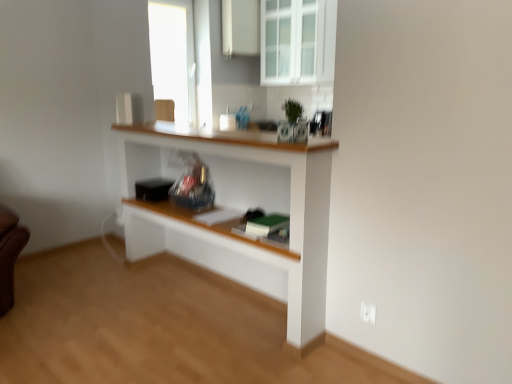
From the picture: Measure the distance between white glass cabinet at upper center and camera.

white glass cabinet at upper center is 3.89 meters away from camera.

Identify the location of white glossy cabinet at upper center. (241, 27).

Identify the location of white glass cabinet at upper center. The image size is (512, 384). (290, 41).

From a real-world perspective, between white plastic electric outlet at lower right and white wood shelf at center, who is vertically higher?

white wood shelf at center is physically above.

From the picture: From the image's perspective, between white plastic electric outlet at lower right and white wood shelf at center, who is located below?

white plastic electric outlet at lower right, from the image's perspective.

Choose the correct answer: Is white plastic electric outlet at lower right inside white wood shelf at center or outside it?

white plastic electric outlet at lower right is not inside white wood shelf at center, it's outside.

Could you tell me if white plastic electric outlet at lower right is turned towards white wood shelf at center?

No, white plastic electric outlet at lower right is not oriented towards white wood shelf at center.

Is point (241, 24) farther from camera compared to point (269, 158)?

Yes.

Is white glossy cabinet at upper center with white wood shelf at center?

white glossy cabinet at upper center and white wood shelf at center are clearly separated.

Is white glossy cabinet at upper center aimed at white wood shelf at center?

No, white glossy cabinet at upper center is not oriented towards white wood shelf at center.

Considering the sizes of white glossy cabinet at upper center and white glass cabinet at upper center in the image, is white glossy cabinet at upper center bigger or smaller than white glass cabinet at upper center?

Considering their sizes, white glossy cabinet at upper center takes up less space than white glass cabinet at upper center.

Consider the image. Considering the relative sizes of white glossy cabinet at upper center and white glass cabinet at upper center in the image provided, is white glossy cabinet at upper center taller than white glass cabinet at upper center?

No.

Consider the image. What's the angular difference between white glossy cabinet at upper center and white glass cabinet at upper center's facing directions?

There is a 90.2-degree angle between the facing directions of white glossy cabinet at upper center and white glass cabinet at upper center.

Is point (252, 39) closer to camera compared to point (269, 69)?

Yes, point (252, 39) is closer to viewer.

Is white wood shelf at center thinner than white plastic electric outlet at lower right?

Incorrect, the width of white wood shelf at center is not less than that of white plastic electric outlet at lower right.

The width and height of the screenshot is (512, 384). I want to click on electric outlet below the white wood shelf at center (from a real-world perspective), so click(368, 313).

Consider the image. Which of these two, white wood shelf at center or white plastic electric outlet at lower right, is bigger?

white wood shelf at center.

From a real-world perspective, is white wood shelf at center positioned over white glass cabinet at upper center based on gravity?

No, from a real-world perspective, white wood shelf at center is not above white glass cabinet at upper center.

What's the angular difference between white wood shelf at center and white glass cabinet at upper center's facing directions?

There is a 1.44-degree angle between the facing directions of white wood shelf at center and white glass cabinet at upper center.

In the scene shown: Considering the sizes of white wood shelf at center and white glass cabinet at upper center in the image, is white wood shelf at center bigger or smaller than white glass cabinet at upper center?

Clearly, white wood shelf at center is larger in size than white glass cabinet at upper center.

Considering the sizes of white wood shelf at center and white glass cabinet at upper center in the image, is white wood shelf at center taller or shorter than white glass cabinet at upper center?

Clearly, white wood shelf at center is taller compared to white glass cabinet at upper center.

Looking at this image, are white wood shelf at center and white glossy cabinet at upper center beside each other?

No, white wood shelf at center is not next to white glossy cabinet at upper center.

Considering the relative sizes of white wood shelf at center and white glossy cabinet at upper center in the image provided, is white wood shelf at center smaller than white glossy cabinet at upper center?

No.

This screenshot has width=512, height=384. I want to click on shelf on the left of the white glossy cabinet at upper center, so click(240, 210).

Which point is more distant from viewer, (272, 195) or (223, 36)?

Point (223, 36)

From the image's perspective, which one is positioned higher, white plastic electric outlet at lower right or white glossy cabinet at upper center?

white glossy cabinet at upper center, from the image's perspective.

In the scene shown: Is white plastic electric outlet at lower right directly adjacent to white glossy cabinet at upper center?

No, white plastic electric outlet at lower right is not in contact with white glossy cabinet at upper center.

Based on their positions, is white plastic electric outlet at lower right located to the left or right of white glossy cabinet at upper center?

Based on their positions, white plastic electric outlet at lower right is located to the right of white glossy cabinet at upper center.

Locate an element on the screen. This screenshot has height=384, width=512. shelf above the white plastic electric outlet at lower right (from the image's perspective) is located at coordinates tap(240, 210).

Where is `shelf located in front of the white glossy cabinet at upper center`? This screenshot has width=512, height=384. shelf located in front of the white glossy cabinet at upper center is located at coordinates (240, 210).

When comparing their distances from white glass cabinet at upper center, does white plastic electric outlet at lower right or white glossy cabinet at upper center seem closer?

white glossy cabinet at upper center is positioned closer to the anchor white glass cabinet at upper center.

Which object lies further to the anchor point white plastic electric outlet at lower right, white glass cabinet at upper center or white glossy cabinet at upper center?

Based on the image, white glossy cabinet at upper center appears to be further to white plastic electric outlet at lower right.

From the image, which object appears to be nearer to white glossy cabinet at upper center, white plastic electric outlet at lower right or white glass cabinet at upper center?

white glass cabinet at upper center is positioned closer to the anchor white glossy cabinet at upper center.

Based on their spatial positions, is white glass cabinet at upper center or white wood shelf at center further from white plastic electric outlet at lower right?

Among the two, white glass cabinet at upper center is located further to white plastic electric outlet at lower right.

Considering their positions, is white glossy cabinet at upper center positioned closer to white glass cabinet at upper center than white plastic electric outlet at lower right?

Based on the image, white glossy cabinet at upper center appears to be nearer to white glass cabinet at upper center.

Based on their spatial positions, is white wood shelf at center or white glossy cabinet at upper center further from white glass cabinet at upper center?

The object further to white glass cabinet at upper center is white wood shelf at center.

From the image, which object appears to be nearer to white wood shelf at center, white plastic electric outlet at lower right or white glass cabinet at upper center?

white plastic electric outlet at lower right lies closer to white wood shelf at center than the other object.

From the image, which object appears to be farther from white glossy cabinet at upper center, white wood shelf at center or white glass cabinet at upper center?

Based on the image, white wood shelf at center appears to be further to white glossy cabinet at upper center.

Where is `electric outlet positioned between white wood shelf at center and white glossy cabinet at upper center from near to far`? electric outlet positioned between white wood shelf at center and white glossy cabinet at upper center from near to far is located at coordinates (368, 313).

Find the location of `window that lies between white glossy cabinet at upper center and white plastic electric outlet at lower right from top to bottom`. window that lies between white glossy cabinet at upper center and white plastic electric outlet at lower right from top to bottom is located at coordinates (290, 41).

You are a GUI agent. You are given a task and a screenshot of the screen. Output one action in this format:
    pyautogui.click(x=<x>, y=<y>)
    Task: Click on the shelf between white glass cabinet at upper center and white plastic electric outlet at lower right vertically
    This screenshot has width=512, height=384.
    Given the screenshot: What is the action you would take?
    pyautogui.click(x=240, y=210)

The width and height of the screenshot is (512, 384). In order to click on window between white wood shelf at center and white glossy cabinet at upper center in the front-back direction in this screenshot , I will do `click(290, 41)`.